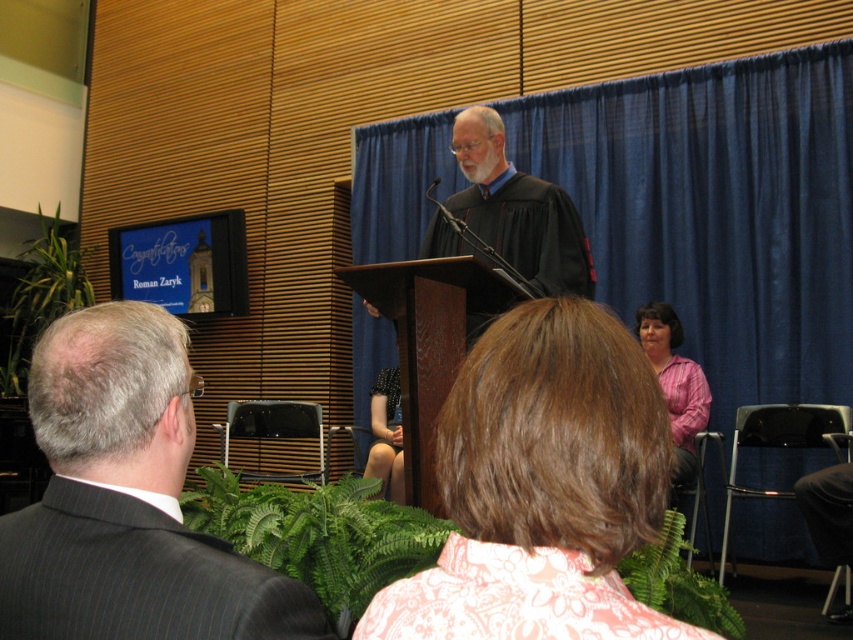
In the scene shown: You are an attendee at the graduation ceremony and want to move from your seat to the podium. You notice two points marked in the image. The first point is at coordinate point (759, 284) and the second is at point (665, 372). Which point should you head towards to reach the podium faster?

Point (759, 284) is in front of point (665, 372), so you should head towards point (759, 284) to reach the podium faster.

You are a photographer at the graduation ceremony and want to capture both the pink floral blouse at center and the pink shirt at lower right in the same frame. Which clothing item should you focus on first to ensure both are in the frame?

The pink floral blouse at center is smaller in size compared to the pink shirt at lower right, so you should focus on the pink shirt at lower right first to ensure both are in the frame.

You are an event planner setting up a photo backdrop. You need to choose between the blue fabric curtain at upper center and the pink shirt at lower right for a larger display. Based on the scene, which object is wider?

The blue fabric curtain at upper center is wider than the pink shirt at lower right according to the description.